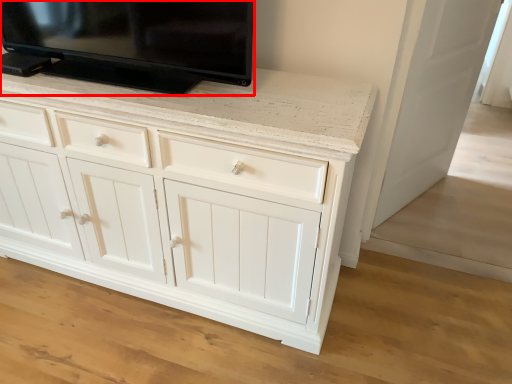
Question: Observing the image, what is the correct spatial positioning of television (annotated by the red box) in reference to door?

Choices:
 (A) left
 (B) right

Answer: (A)